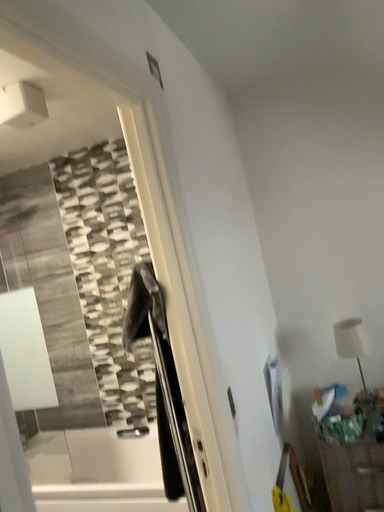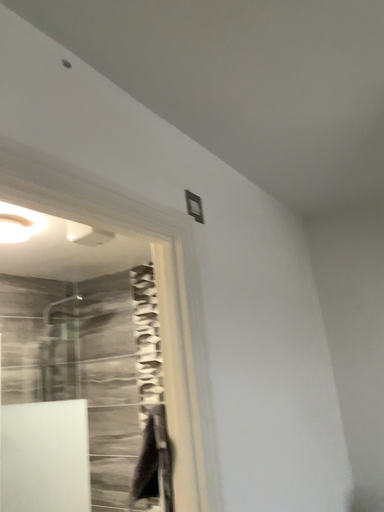
Question: Which way did the camera rotate in the video?

Choices:
 (A) rotated downward
 (B) rotated upward

Answer: (B)